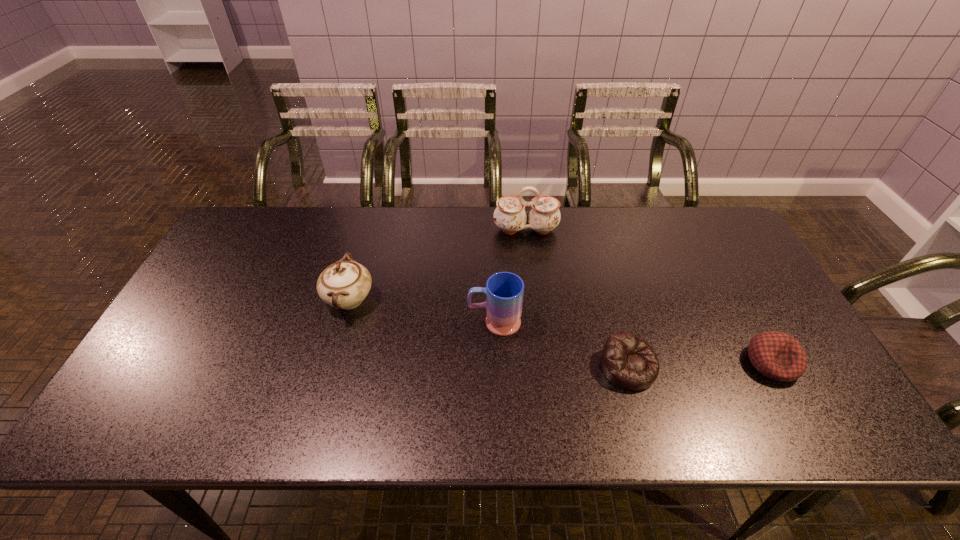
Find the location of a particular element. free location that satisfies the following two spatial constraints: 1. by the handle of the right beanbag; 2. on the left side of the right chinaware is located at coordinates (541, 363).

Image resolution: width=960 pixels, height=540 pixels. I want to click on vacant space that satisfies the following two spatial constraints: 1. by the handle of the right chinaware; 2. on the left side of the right beanbag, so click(541, 363).

At what (x,y) coordinates should I click in order to perform the action: click on free location that satisfies the following two spatial constraints: 1. on the side of the mug with the handle; 2. on the left side of the rightmost object. Please return your answer as a coordinate pair (x, y). This screenshot has width=960, height=540. Looking at the image, I should click on (495, 363).

You are a GUI agent. You are given a task and a screenshot of the screen. Output one action in this format:
    pyautogui.click(x=<x>, y=<y>)
    Task: Click on the vacant space that satisfies the following two spatial constraints: 1. by the handle of the rightmost object; 2. on the right side of the farther chinaware
    The height and width of the screenshot is (540, 960).
    Given the screenshot: What is the action you would take?
    pyautogui.click(x=541, y=363)

At what (x,y) coordinates should I click in order to perform the action: click on free spot that satisfies the following two spatial constraints: 1. on the side of the mug with the handle; 2. on the right side of the rightmost object. Please return your answer as a coordinate pair (x, y). Image resolution: width=960 pixels, height=540 pixels. Looking at the image, I should click on (495, 363).

The image size is (960, 540). Identify the location of vacant space that satisfies the following two spatial constraints: 1. on the side of the mug with the handle; 2. on the back side of the right beanbag. (495, 363).

Where is `vacant area that satisfies the following two spatial constraints: 1. on the back side of the right beanbag; 2. on the left side of the left beanbag`? vacant area that satisfies the following two spatial constraints: 1. on the back side of the right beanbag; 2. on the left side of the left beanbag is located at coordinates (628, 363).

The height and width of the screenshot is (540, 960). I want to click on free spot that satisfies the following two spatial constraints: 1. by the handle of the right chinaware; 2. on the right side of the left beanbag, so click(541, 367).